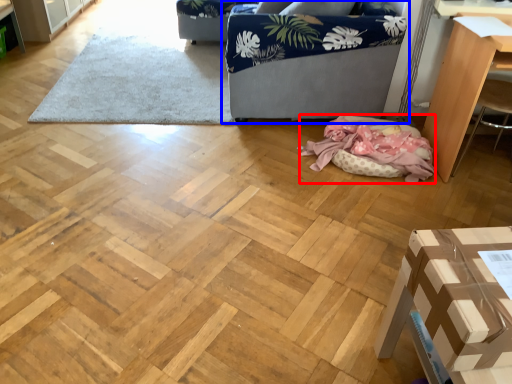
Question: Which point is further to the camera, blanket (highlighted by a red box) or studio couch (highlighted by a blue box)?

Choices:
 (A) blanket
 (B) studio couch

Answer: (B)